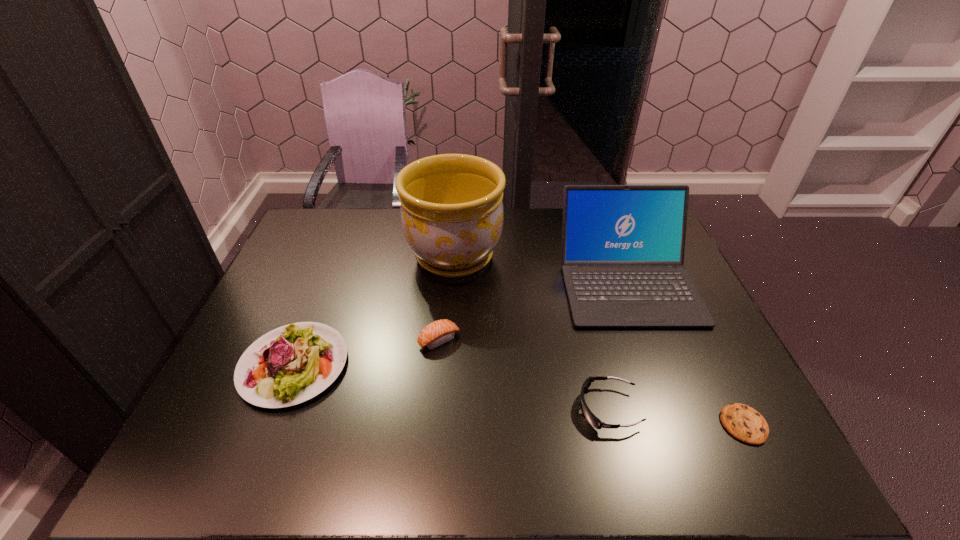
Locate an element on the screen. The image size is (960, 540). flowerpot is located at coordinates pos(452,215).

Where is `the second tallest object`? This screenshot has width=960, height=540. the second tallest object is located at coordinates (623, 246).

Where is `salad plate`? The height and width of the screenshot is (540, 960). salad plate is located at coordinates (291, 364).

The width and height of the screenshot is (960, 540). Identify the location of the fourth shortest object. (291, 364).

Locate an element on the screen. This screenshot has width=960, height=540. sushi is located at coordinates (437, 333).

At what (x,y) coordinates should I click in order to perform the action: click on goggles. Please return your answer as a coordinate pair (x, y). Looking at the image, I should click on coord(590,417).

The image size is (960, 540). In order to click on the shortest object in this screenshot , I will do `click(744, 423)`.

At what (x,y) coordinates should I click in order to perform the action: click on free space located 0.380m on the front of the flowerpot. Please return your answer as a coordinate pair (x, y). The width and height of the screenshot is (960, 540). Looking at the image, I should click on [444, 397].

The image size is (960, 540). Identify the location of vacant space positioned 0.380m on the screen of the second tallest object. (696, 464).

At what (x,y) coordinates should I click in order to perform the action: click on vacant space located on the right of the third tallest object. Please return your answer as a coordinate pair (x, y). The height and width of the screenshot is (540, 960). Looking at the image, I should click on (391, 365).